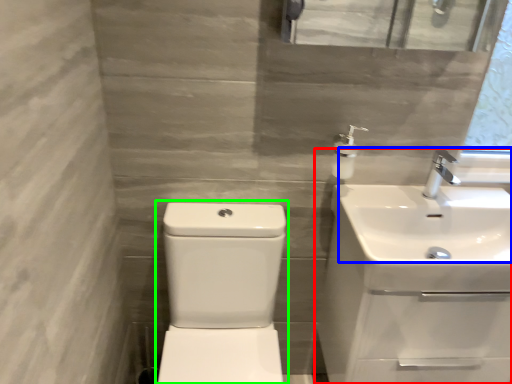
Question: Which object is the closest to the sink (highlighted by a red box)? Choose among these: sink (highlighted by a blue box) or sink (highlighted by a green box).

Choices:
 (A) sink
 (B) sink

Answer: (A)